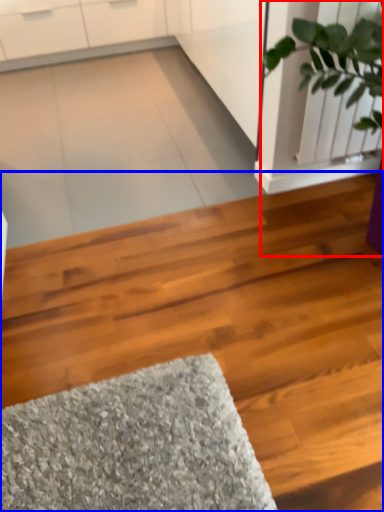
Question: Which of the following is the farthest to the observer, houseplant (highlighted by a red box) or hardwood (highlighted by a blue box)?

Choices:
 (A) houseplant
 (B) hardwood

Answer: (A)